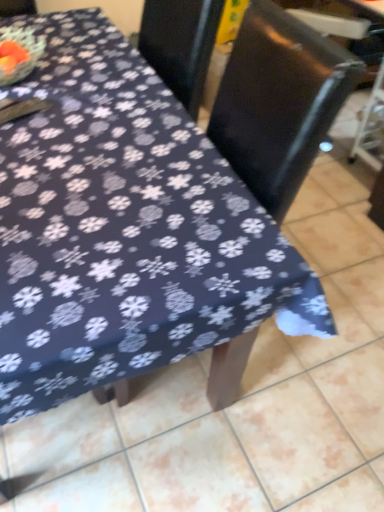
Question: Based on their positions, is black glossy chair at upper center located to the left or right of black plastic swivel chair at right?

Choices:
 (A) right
 (B) left

Answer: (B)

Question: Is black glossy chair at upper center bigger or smaller than black plastic swivel chair at right?

Choices:
 (A) big
 (B) small

Answer: (B)

Question: Is black glossy chair at upper center in front of or behind black plastic swivel chair at right in the image?

Choices:
 (A) behind
 (B) front

Answer: (B)

Question: In terms of width, does black plastic swivel chair at right look wider or thinner when compared to black glossy chair at upper center?

Choices:
 (A) thin
 (B) wide

Answer: (B)

Question: In the image, is black plastic swivel chair at right positioned in front of or behind black glossy chair at upper center?

Choices:
 (A) behind
 (B) front

Answer: (A)

Question: From a real-world perspective, relative to black glossy chair at upper center, is black plastic swivel chair at right vertically above or below?

Choices:
 (A) above
 (B) below

Answer: (B)

Question: Is black plastic swivel chair at right bigger or smaller than black glossy chair at upper center?

Choices:
 (A) big
 (B) small

Answer: (A)